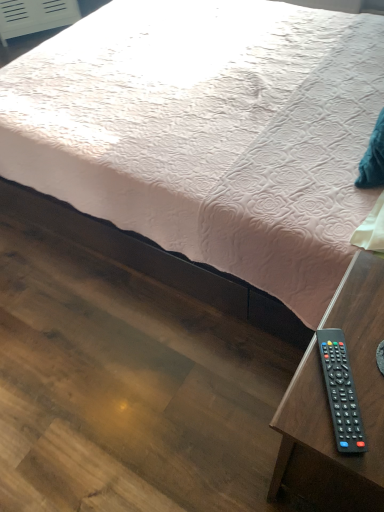
Identify the location of free point behind black plastic remote at lower right. (351, 307).